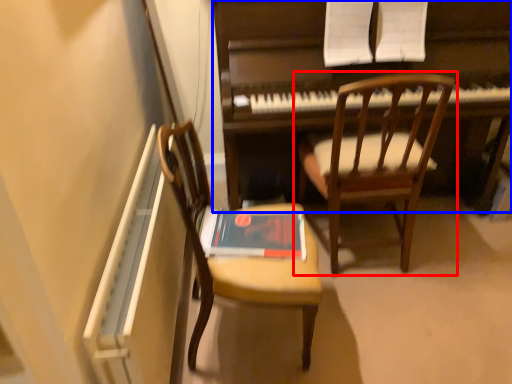
Question: Which object is closer to the camera taking this photo, chair (highlighted by a red box) or piano (highlighted by a blue box)?

Choices:
 (A) chair
 (B) piano

Answer: (A)